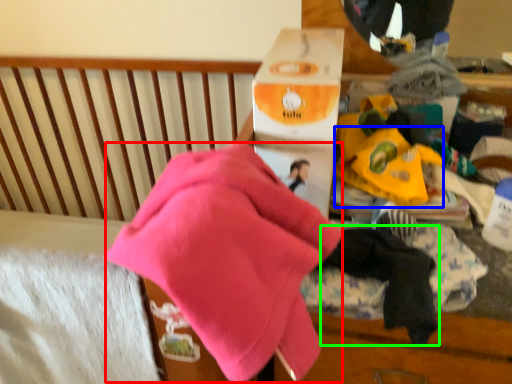
Question: Considering the real-world distances, which object is farthest from underclothes (highlighted by a red box)? toy (highlighted by a blue box) or baby clothe (highlighted by a green box)?

Choices:
 (A) toy
 (B) baby clothe

Answer: (A)